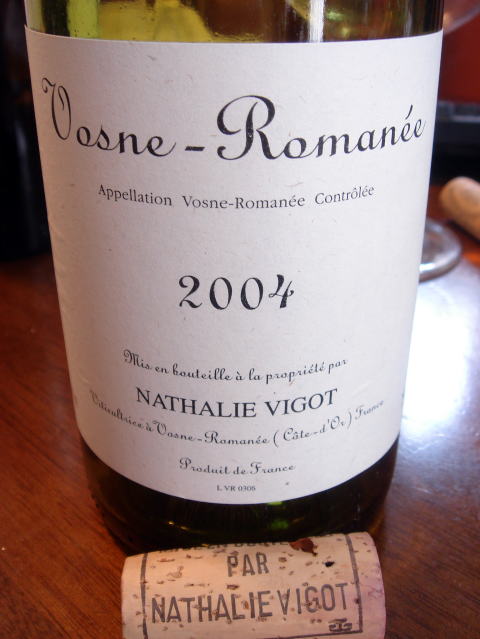
Find the location of a particular element. The image size is (480, 639). clear stem of wine glass is located at coordinates (442, 257).